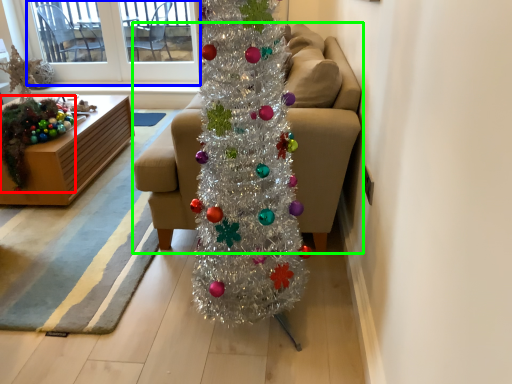
Question: Estimate the real-world distances between objects in this image. Which object is closer to christmas decoration (highlighted by a red box), window screen (highlighted by a blue box) or studio couch (highlighted by a green box)?

Choices:
 (A) window screen
 (B) studio couch

Answer: (B)